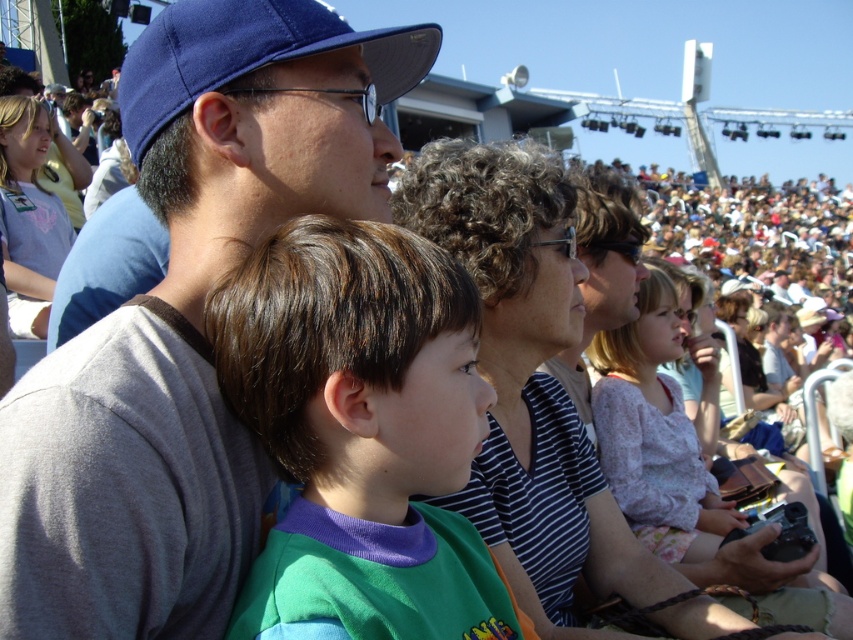
Question: From the image, what is the correct spatial relationship of blue fabric cap at upper left in relation to green fabric shirt at center?

Choices:
 (A) left
 (B) right

Answer: (A)

Question: Which of the following is the farthest from the observer?

Choices:
 (A) blue fabric baseball cap at upper left
 (B) blue fabric cap at upper left
 (C) green fabric shirt at center

Answer: (A)

Question: Is blue fabric cap at upper left positioned before blue fabric baseball cap at upper left?

Choices:
 (A) yes
 (B) no

Answer: (A)

Question: Which of the following is the farthest from the observer?

Choices:
 (A) green fabric shirt at center
 (B) blue fabric baseball cap at upper left
 (C) blue fabric cap at upper left

Answer: (B)

Question: Is blue fabric cap at upper left below green fabric shirt at center?

Choices:
 (A) yes
 (B) no

Answer: (B)

Question: Which of the following is the farthest from the observer?

Choices:
 (A) (165, 538)
 (B) (355, 460)
 (C) (132, 106)

Answer: (C)